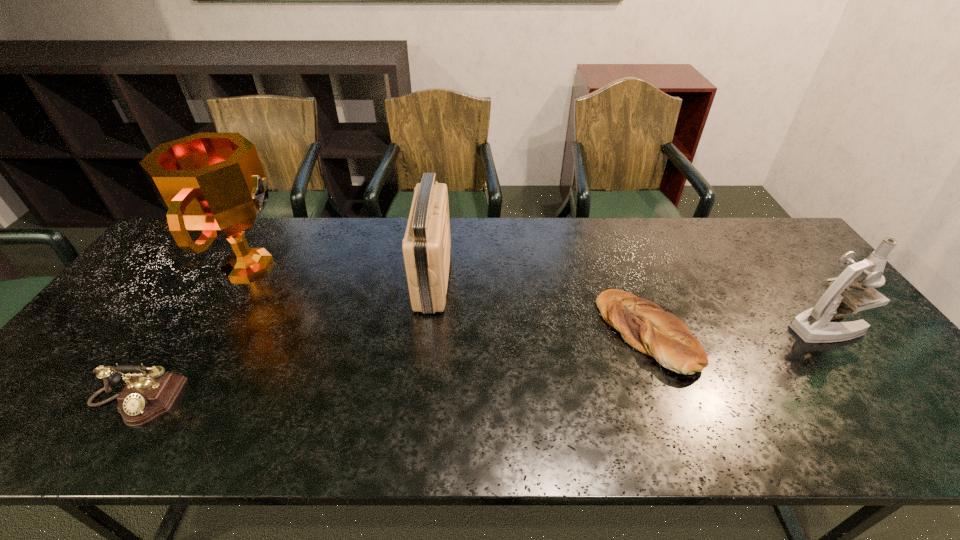
This screenshot has width=960, height=540. In order to click on the tallest object in this screenshot , I will do `click(213, 185)`.

Find the location of a particular element. the third object from right to left is located at coordinates pos(426,246).

Locate an element on the screen. This screenshot has width=960, height=540. the rightmost object is located at coordinates (813, 325).

Identify the location of the second shortest object. (145, 396).

Find the location of `bread`. bread is located at coordinates (644, 325).

Where is `the fourth object from left to right`? Image resolution: width=960 pixels, height=540 pixels. the fourth object from left to right is located at coordinates (644, 325).

Identify the location of vacant space situated 0.110m on the side of the award with the star emblem. (327, 265).

You are a GUI agent. You are given a task and a screenshot of the screen. Output one action in this format:
    pyautogui.click(x=<x>, y=<y>)
    Task: Click on the free location located on the front-facing side of the radio receiver
    
    Given the screenshot: What is the action you would take?
    pyautogui.click(x=493, y=278)

Find the location of `free space located 0.170m on the left of the microscope`. free space located 0.170m on the left of the microscope is located at coordinates (725, 327).

Locate an element on the screen. The image size is (960, 540). free spot located 0.090m on the left of the bread is located at coordinates (568, 334).